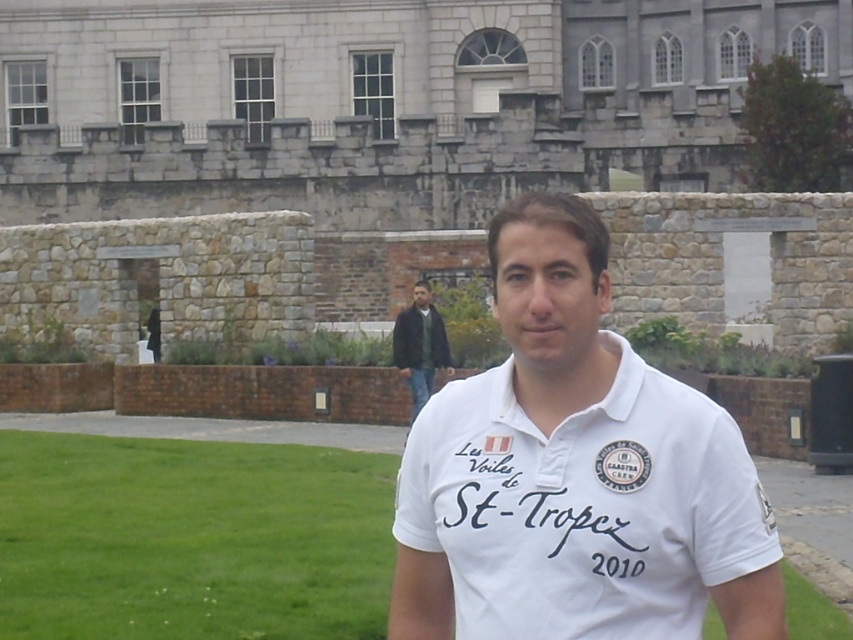
Question: Which object appears farthest from the camera in this image?

Choices:
 (A) white cotton polo shirt at center
 (B) green grass at center

Answer: (B)

Question: Which of the following is the farthest from the observer?

Choices:
 (A) (306, 449)
 (B) (407, 364)
 (C) (689, 525)

Answer: (B)

Question: In this image, where is white cotton polo shirt at center located relative to dark green leather jacket at center?

Choices:
 (A) right
 (B) left

Answer: (A)

Question: Based on their relative distances, which object is farther from the white cotton polo shirt at center?

Choices:
 (A) green grass at center
 (B) dark green leather jacket at center

Answer: (B)

Question: Does white cotton polo shirt at center appear on the left side of green grass at center?

Choices:
 (A) yes
 (B) no

Answer: (B)

Question: Is white cotton polo shirt at center positioned in front of dark green leather jacket at center?

Choices:
 (A) yes
 (B) no

Answer: (A)